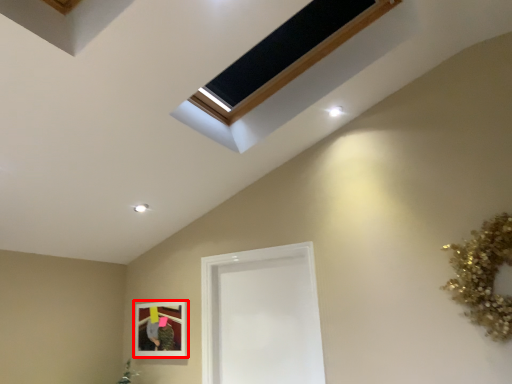
Question: Considering the relative positions of picture frame (annotated by the red box) and glass door in the image provided, where is picture frame (annotated by the red box) located with respect to the staircase?

Choices:
 (A) left
 (B) right

Answer: (A)